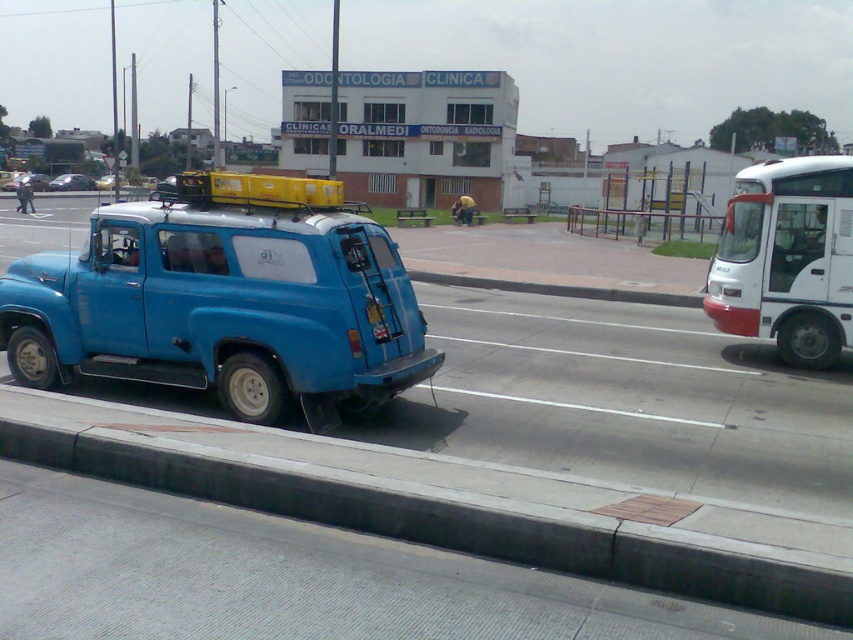
You are standing at the point with coordinates (787, 259) in the image. What object is located exactly at this point?

The white glossy bus at right is located exactly at point (787, 259).

You are a delivery person trying to park your vehicle between the white glossy bus at right and the blue matte van at center. Based on their widths, which vehicle should you position your vehicle next to to ensure enough space?

The white glossy bus at right is thinner than the blue matte van at center, so positioning your vehicle next to the white glossy bus at right would leave more space for parking.